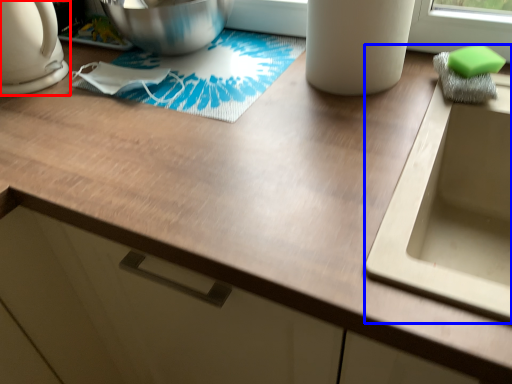
Question: Among these objects, which one is nearest to the camera, kitchen appliance (highlighted by a red box) or sink (highlighted by a blue box)?

Choices:
 (A) kitchen appliance
 (B) sink

Answer: (B)